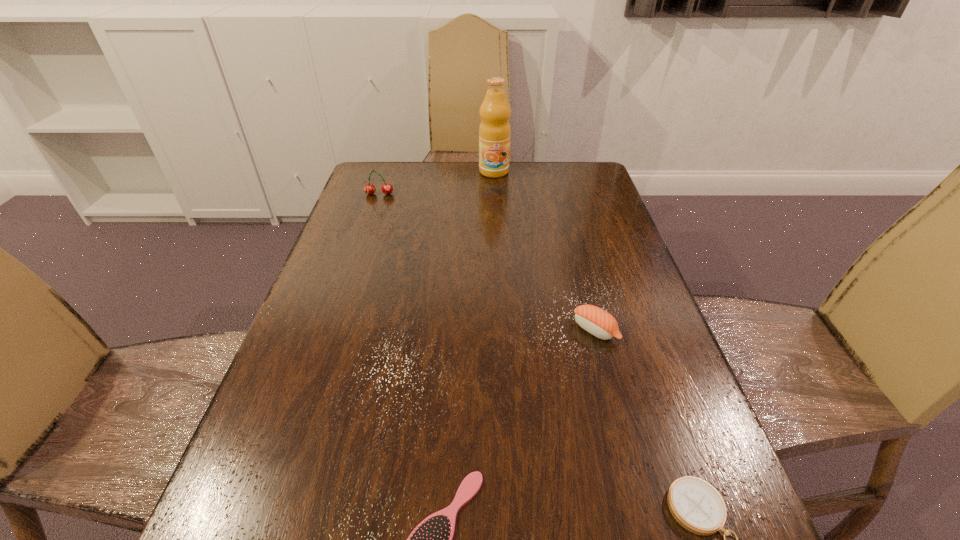
The width and height of the screenshot is (960, 540). In order to click on empty space between the farthest object and the leftmost object in this screenshot , I will do `click(437, 183)`.

Locate an element on the screen. The image size is (960, 540). unoccupied area between the sushi and the leftmost object is located at coordinates (488, 262).

Where is `vacant area that lies between the third tallest object and the farthest object`? vacant area that lies between the third tallest object and the farthest object is located at coordinates (544, 251).

Locate which object ranks third in proximity to the second tallest object. Please provide its 2D coordinates. Your answer should be formatted as a tuple, i.e. [(x, y)], where the tuple contains the x and y coordinates of a point satisfying the conditions above.

[(432, 539)]

Point out which object is positioned as the fourth nearest to the hairbrush. Please provide its 2D coordinates. Your answer should be formatted as a tuple, i.e. [(x, y)], where the tuple contains the x and y coordinates of a point satisfying the conditions above.

[(494, 131)]